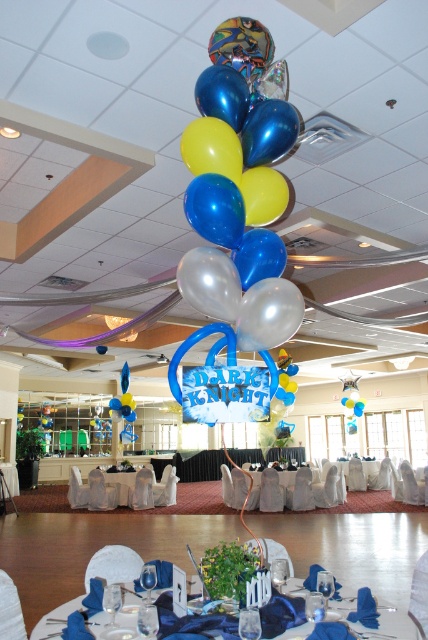
Does point (404, 620) come behind point (225, 202)?

That is True.

Identify the location of blue satin tablecloth at center. The height and width of the screenshot is (640, 428). (389, 625).

Identify the location of blue satin tablecloth at center. (389, 625).

Does blue metallic balloon at center appear on the right side of white glossy table at center?

Yes, blue metallic balloon at center is to the right of white glossy table at center.

Which is more to the right, blue metallic balloon at center or white glossy table at center?

blue metallic balloon at center is more to the right.

Describe the element at coordinates (214, 209) in the screenshot. I see `blue metallic balloon at center` at that location.

Identify the location of blue metallic balloon at center. This screenshot has height=640, width=428. (214, 209).

Does blue satin tablecloth at center have a greater height compared to white fabric table at center?

No.

Can you confirm if blue satin tablecloth at center is positioned above white fabric table at center?

Indeed, blue satin tablecloth at center is positioned over white fabric table at center.

The image size is (428, 640). What are the coordinates of `blue satin tablecloth at center` in the screenshot? It's located at click(x=389, y=625).

The image size is (428, 640). In order to click on blue satin tablecloth at center in this screenshot , I will do `click(389, 625)`.